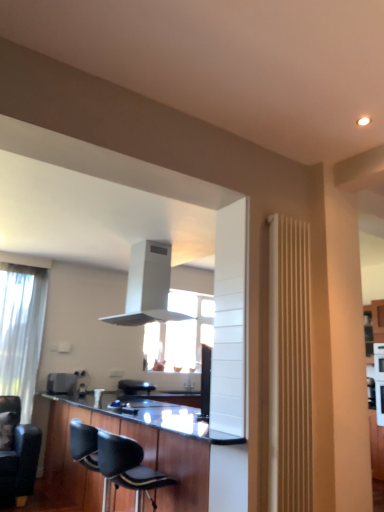
Question: Would you say white matte exhaust hood at upper center is inside or outside black leather armchair at center?

Choices:
 (A) outside
 (B) inside

Answer: (A)

Question: In the image, is white matte exhaust hood at upper center on the left side or the right side of black leather armchair at center?

Choices:
 (A) right
 (B) left

Answer: (A)

Question: Estimate the real-world distances between objects in this image. Which object is closer to the black leather chair at lower left, the 1th chair from the left?

Choices:
 (A) black leather chair at lower center, the 1th chair in the front-to-back sequence
 (B) black leather armchair at center
 (C) satin black toaster at lower left
 (D) white textured radiator at right
 (E) white matte exhaust hood at upper center

Answer: (A)

Question: Estimate the real-world distances between objects in this image. Which object is closer to the black leather armchair at center?

Choices:
 (A) black leather chair at lower left, which is counted as the 2th chair, starting from the front
 (B) white textured radiator at right
 (C) satin black toaster at lower left
 (D) black leather chair at lower center, the 1th chair in the front-to-back sequence
 (E) black wood cabinetry at lower center

Answer: (C)